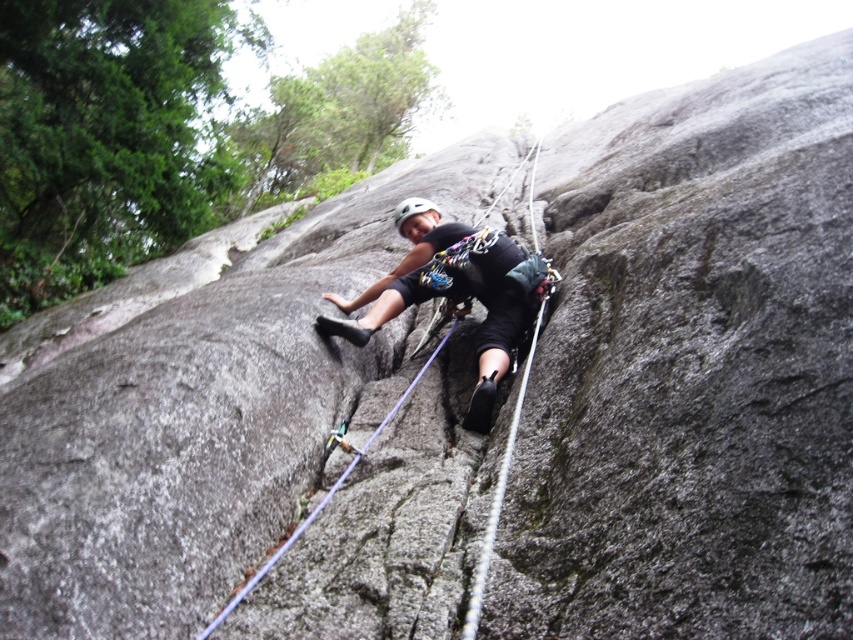
Does matte black helmet at center have a greater height compared to white matte helmet at center?

Yes, matte black helmet at center is taller than white matte helmet at center.

Where is `matte black helmet at center`? matte black helmet at center is located at coordinates (454, 292).